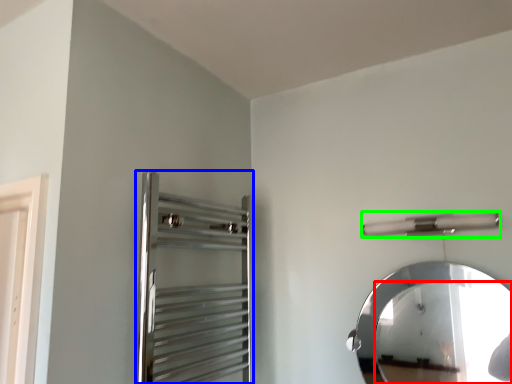
Question: Considering the real-world distances, which object is closest to mirror (highlighted by a red box)? screen door (highlighted by a blue box) or towel bar (highlighted by a green box).

Choices:
 (A) screen door
 (B) towel bar

Answer: (B)